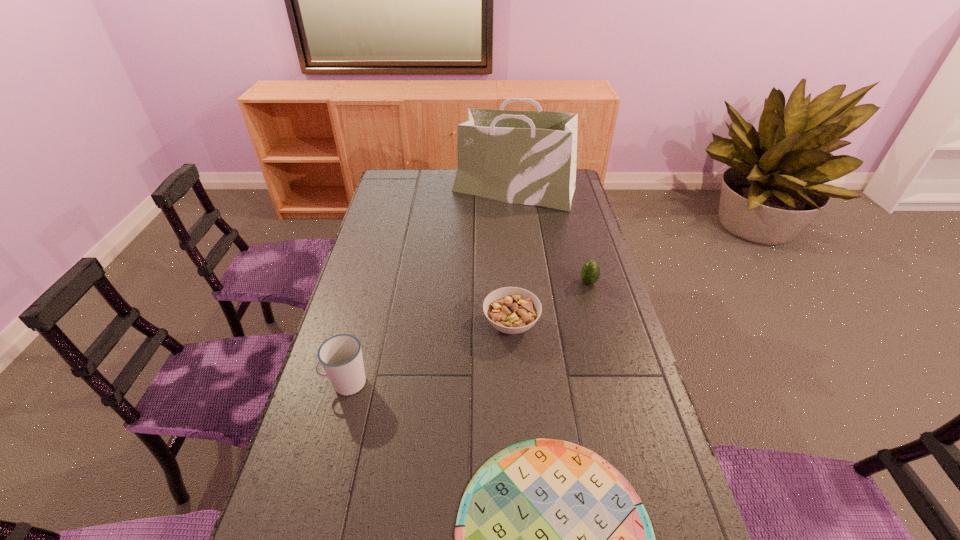
Where is `vacant space located on the left of the third nearest object`? This screenshot has height=540, width=960. vacant space located on the left of the third nearest object is located at coordinates (387, 325).

The height and width of the screenshot is (540, 960). Identify the location of object located at the far edge. (523, 157).

Find the location of a particular element. Image resolution: width=960 pixels, height=540 pixels. object located in the left edge section of the desktop is located at coordinates (x=340, y=356).

Locate an element on the screen. The width and height of the screenshot is (960, 540). grocery bag present at the right edge is located at coordinates (523, 157).

At what (x,y) coordinates should I click in order to perform the action: click on avocado at the right edge. Please return your answer as a coordinate pair (x, y). The height and width of the screenshot is (540, 960). Looking at the image, I should click on (590, 273).

Locate an element on the screen. This screenshot has height=540, width=960. object present at the far right corner is located at coordinates (523, 157).

The image size is (960, 540). In the image, there is a desktop. What are the coordinates of `free space at the far edge` in the screenshot? It's located at (422, 177).

In the image, there is a desktop. Where is `vacant space at the left edge`? Image resolution: width=960 pixels, height=540 pixels. vacant space at the left edge is located at coordinates (314, 417).

In the image, there is a desktop. In order to click on vacant space at the right edge in this screenshot , I will do `click(587, 253)`.

I want to click on free space at the far left corner of the desktop, so click(x=390, y=178).